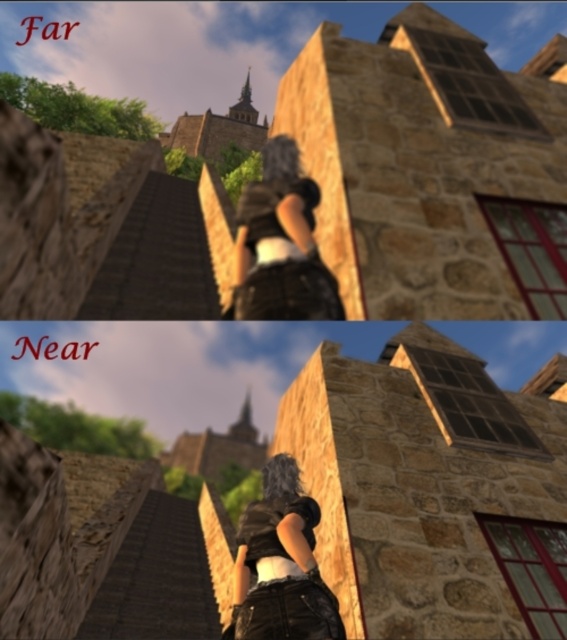
Question: Which point is farther to the camera?

Choices:
 (A) wooden stairs at far
 (B) matte black hair at center
 (C) wooden stairs at far left

Answer: (C)

Question: Which point appears closest to the camera in this image?

Choices:
 (A) (281, 189)
 (B) (286, 552)
 (C) (141, 582)
 (D) (172, 262)

Answer: (B)

Question: Considering the real-world distances, which object is closest to the wooden stairs at far?

Choices:
 (A) wooden stairs at far left
 (B) matte black hair at center
 (C) matte black shirt at center

Answer: (C)

Question: Is wooden stairs at far wider than wooden stairs at far left?

Choices:
 (A) no
 (B) yes

Answer: (B)

Question: Is wooden stairs at far to the right of wooden stairs at far left from the viewer's perspective?

Choices:
 (A) no
 (B) yes

Answer: (B)

Question: Does wooden stairs at far left have a larger size compared to matte black hair at center?

Choices:
 (A) no
 (B) yes

Answer: (B)